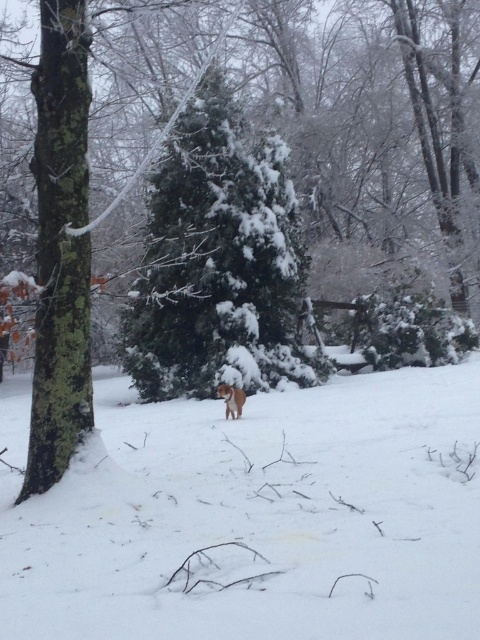
Question: Among these objects, which one is nearest to the camera?

Choices:
 (A) fuzzy brown dog at center
 (B) green textured evergreen tree at center

Answer: (A)

Question: Which point is farther to the camera?

Choices:
 (A) fuzzy brown dog at center
 (B) green textured evergreen tree at center

Answer: (B)

Question: Is white fluffy snow at center bigger than green textured evergreen tree at center?

Choices:
 (A) yes
 (B) no

Answer: (A)

Question: Is white fluffy snow at center to the right of fuzzy brown dog at center from the viewer's perspective?

Choices:
 (A) yes
 (B) no

Answer: (A)

Question: Estimate the real-world distances between objects in this image. Which object is farther from the white fluffy snow at center?

Choices:
 (A) fuzzy brown dog at center
 (B) green textured evergreen tree at center

Answer: (B)

Question: Is white fluffy snow at center below fuzzy brown dog at center?

Choices:
 (A) yes
 (B) no

Answer: (B)